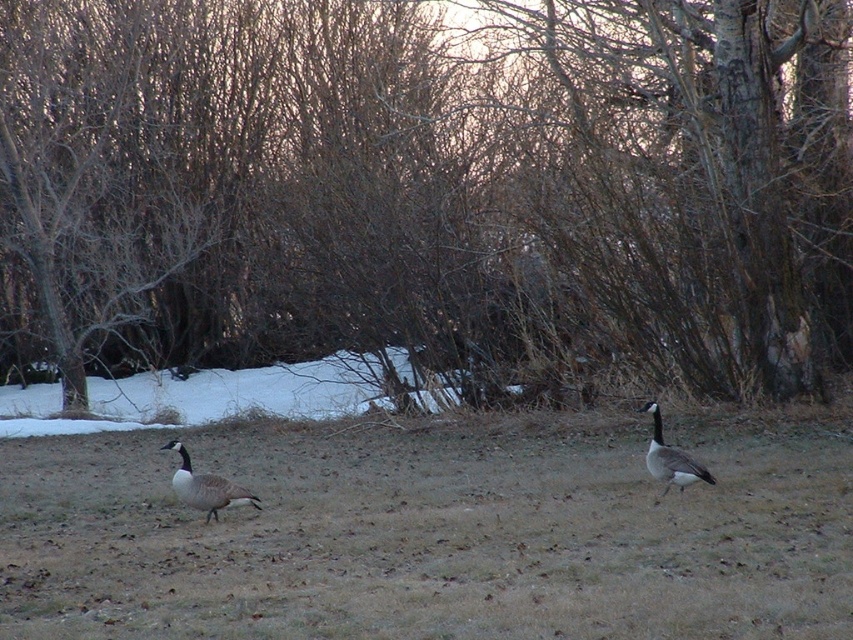
Question: Estimate the real-world distances between objects in this image. Which object is farther from the dark gray feathered goose at right?

Choices:
 (A) brown bark tree at center
 (B) white powder snow at center

Answer: (A)

Question: Considering the relative positions of brown dry grass at center and gray matte goose at lower left in the image provided, where is brown dry grass at center located with respect to gray matte goose at lower left?

Choices:
 (A) below
 (B) above

Answer: (B)

Question: Can you confirm if brown bark tree at center is thinner than dark gray feathered goose at right?

Choices:
 (A) no
 (B) yes

Answer: (A)

Question: Which object is the farthest from the brown bark tree at center?

Choices:
 (A) brown dry grass at center
 (B) dark gray feathered goose at right
 (C) white powder snow at center
 (D) gray matte goose at lower left

Answer: (B)

Question: Which object is farther from the camera taking this photo?

Choices:
 (A) dark gray feathered goose at right
 (B) brown bark tree at center
 (C) gray matte goose at lower left

Answer: (B)

Question: Does brown dry grass at center appear on the left side of white powder snow at center?

Choices:
 (A) yes
 (B) no

Answer: (B)